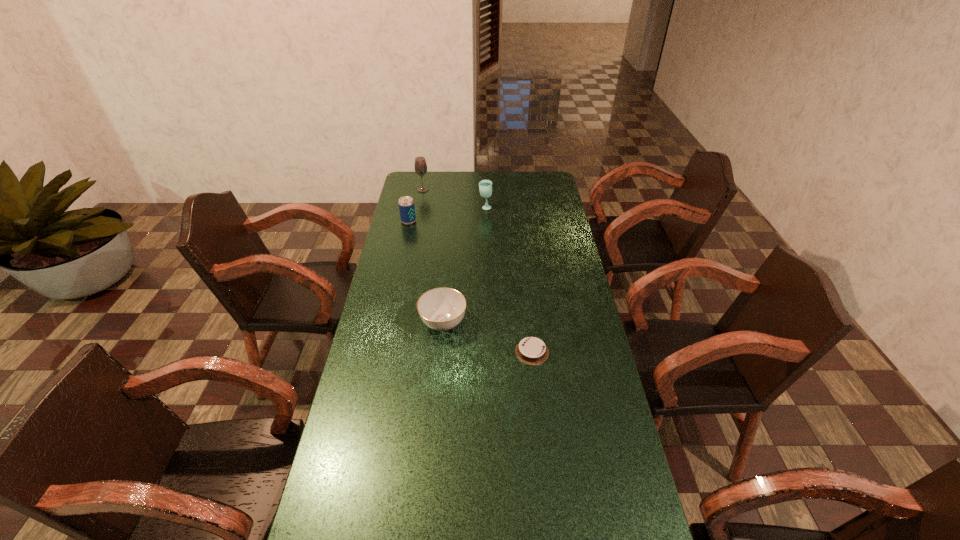
Locate which object ranks fourth in proximity to the taller glass. Please provide its 2D coordinates. Your answer should be formatted as a tuple, i.e. [(x, y)], where the tuple contains the x and y coordinates of a point satisfying the conditions above.

[(531, 350)]

Locate which object is the second closest to the beer can. Please provide its 2D coordinates. Your answer should be formatted as a tuple, i.e. [(x, y)], where the tuple contains the x and y coordinates of a point satisfying the conditions above.

[(485, 186)]

Identify the location of blank area in the image that satisfies the following two spatial constraints: 1. on the front side of the left glass; 2. on the left side of the second farthest object. Image resolution: width=960 pixels, height=540 pixels. point(420,207).

At what (x,y) coordinates should I click in order to perform the action: click on vacant space that satisfies the following two spatial constraints: 1. on the back side of the right glass; 2. on the right side of the third nearest object. Please return your answer as a coordinate pair (x, y). Looking at the image, I should click on (412, 207).